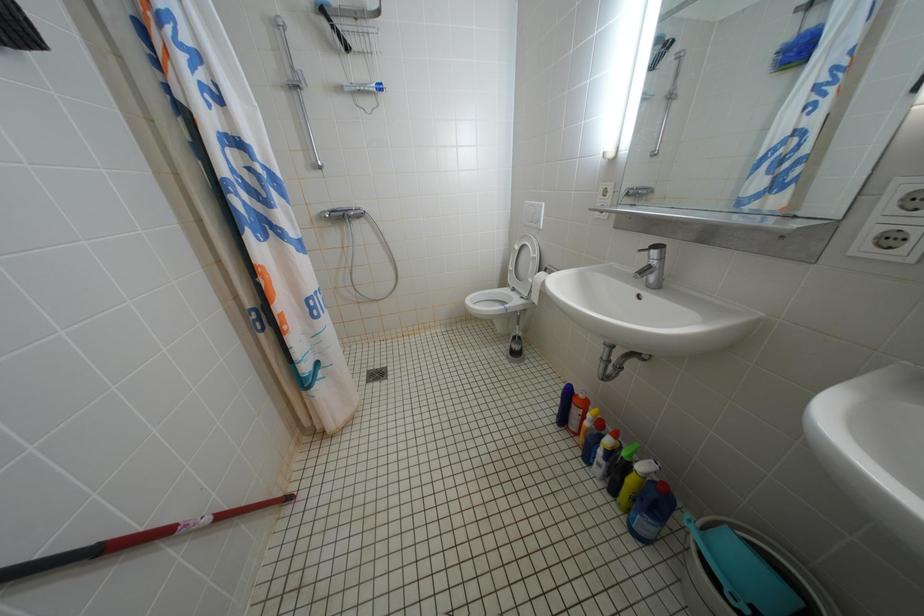
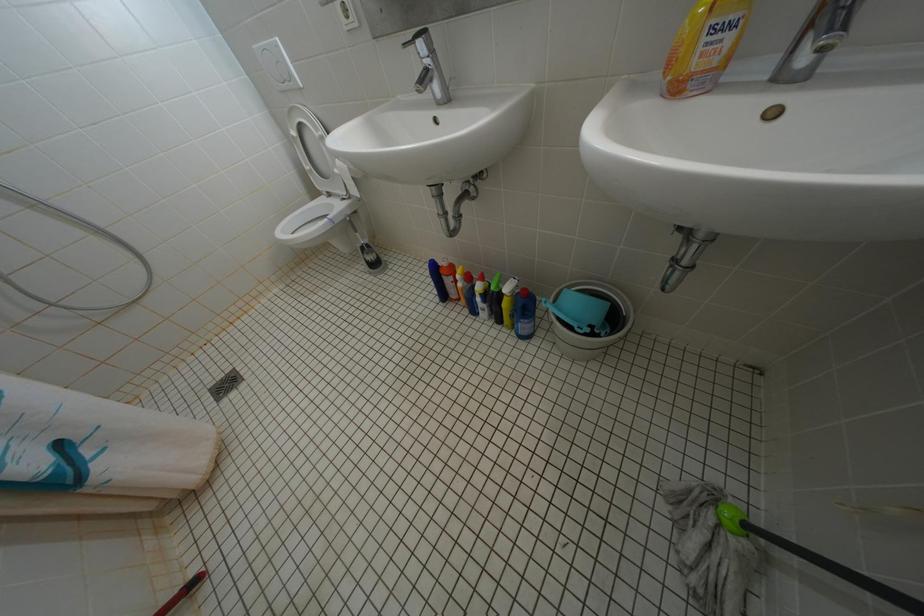
How did the camera likely rotate?

The camera's rotation is toward right-down.